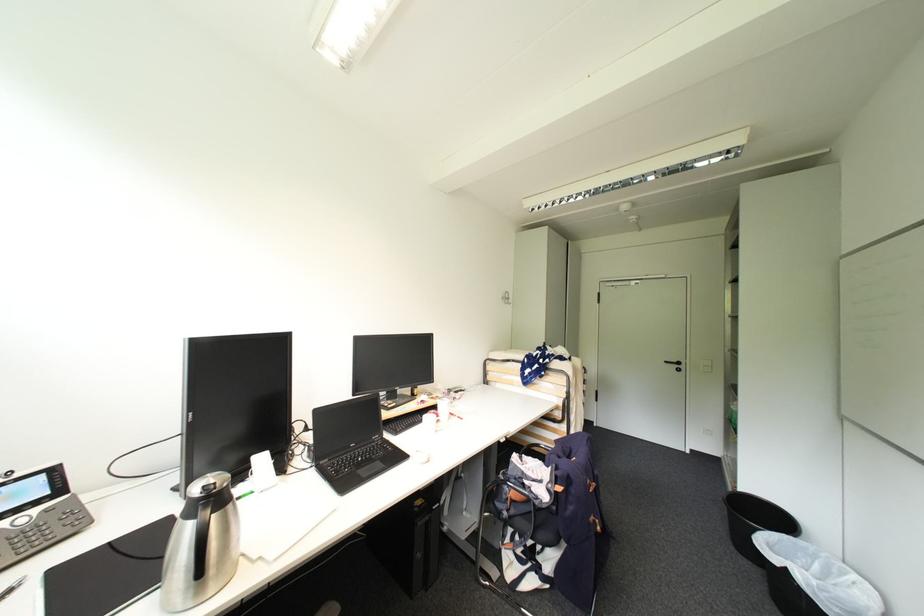
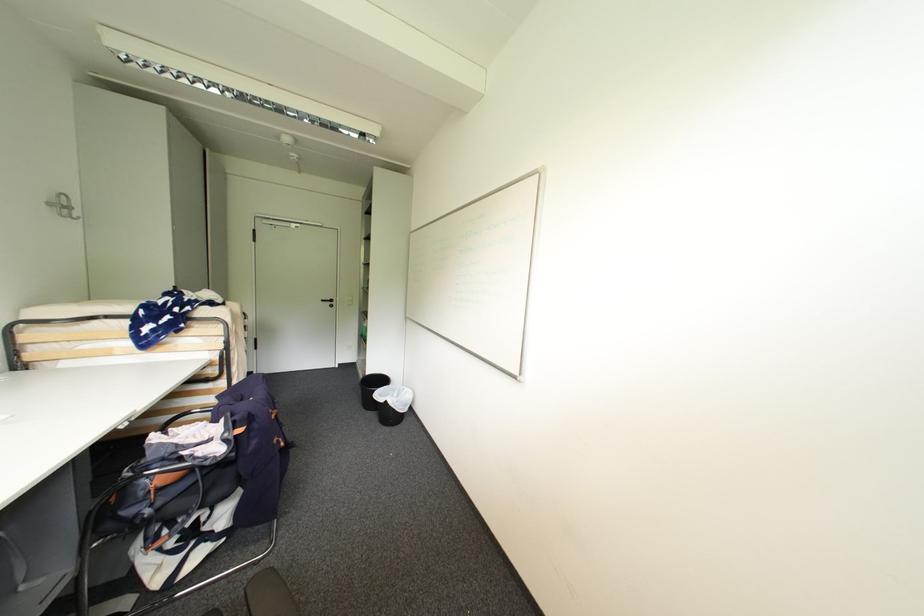
Question: The first image is from the beginning of the video and the second image is from the end. How did the camera likely rotate when shooting the video?

Choices:
 (A) Left
 (B) Right
 (C) Up
 (D) Down

Answer: (B)